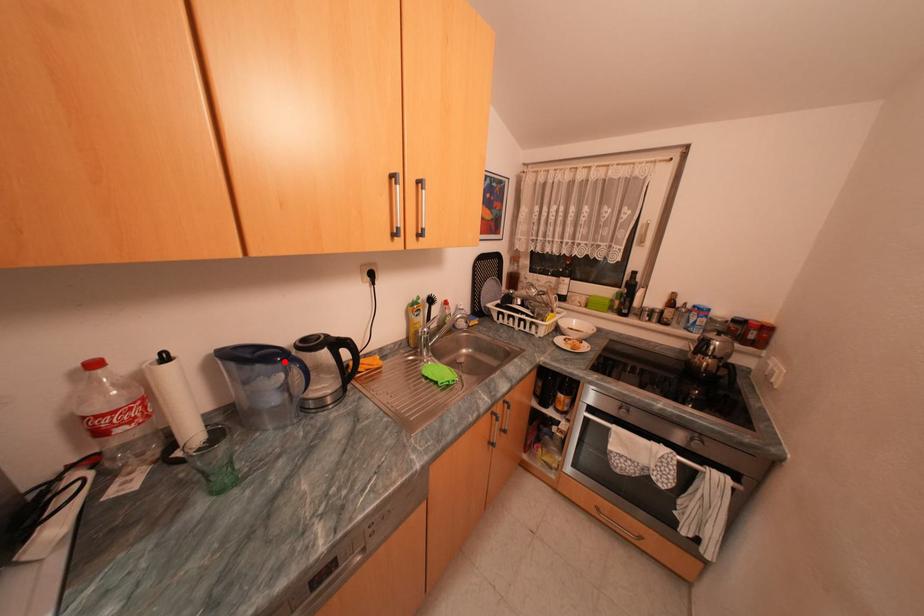
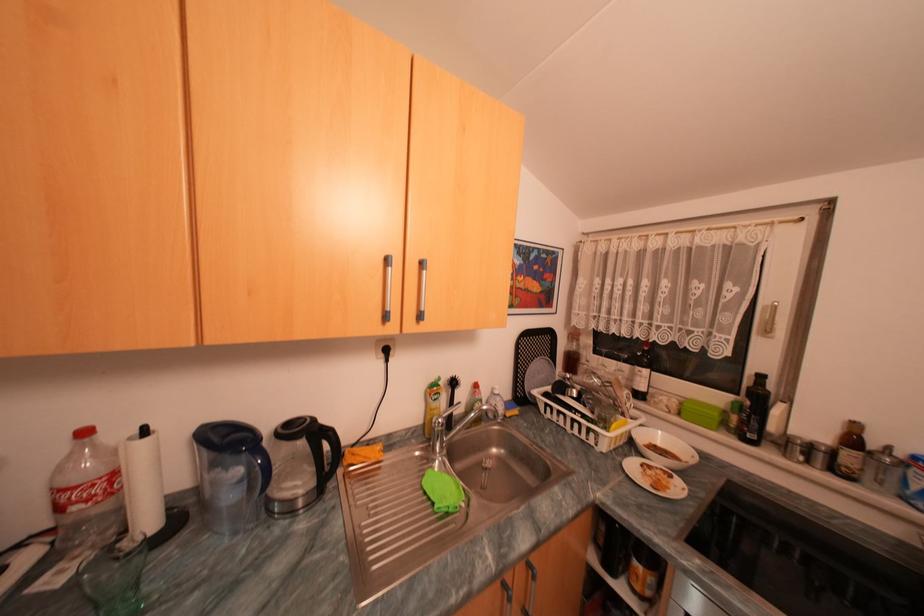
Where in the second image is the point corresponding to the highlighted location from the first image?

(249, 451)